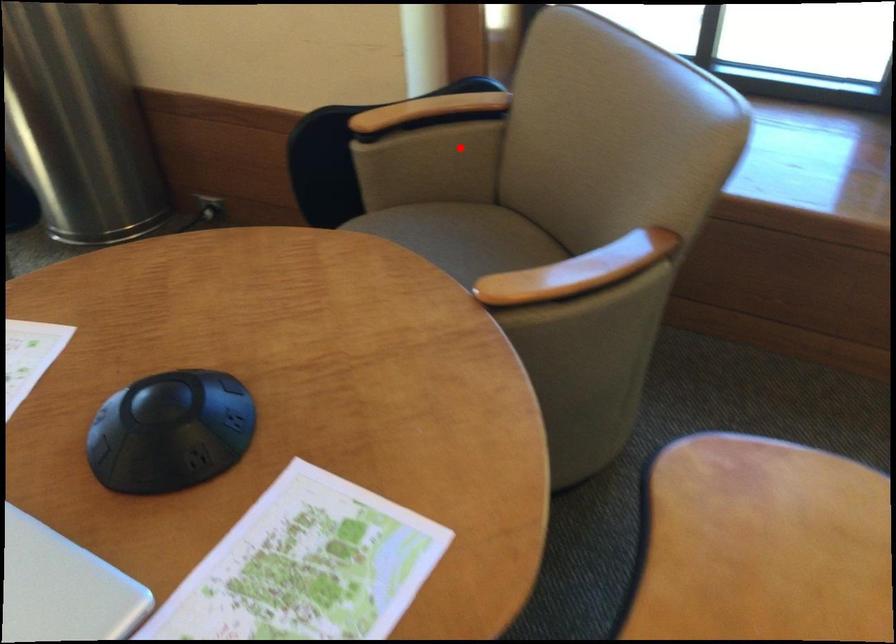
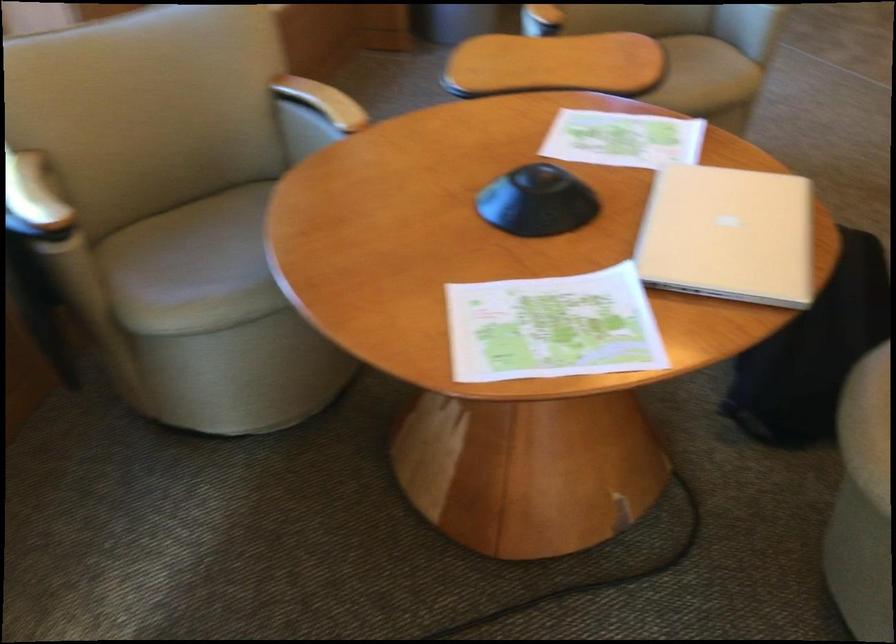
Where in the second image is the point corresponding to the highlighted location from the first image?

(33, 200)